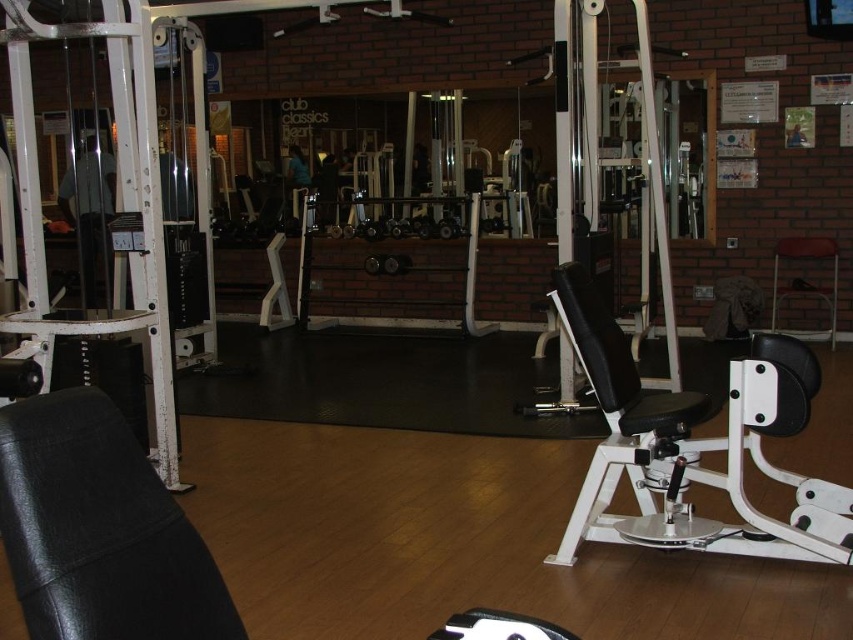
Question: Observing the image, what is the correct spatial positioning of white plastic weight bench at right in reference to metallic stool at right?

Choices:
 (A) left
 (B) right

Answer: (A)

Question: Can you confirm if white plastic weight bench at right is bigger than metallic stool at right?

Choices:
 (A) no
 (B) yes

Answer: (B)

Question: Which point is farther from the camera taking this photo?

Choices:
 (A) (688, 548)
 (B) (779, 244)

Answer: (B)

Question: Observing the image, what is the correct spatial positioning of white plastic weight bench at right in reference to metallic stool at right?

Choices:
 (A) right
 (B) left

Answer: (B)